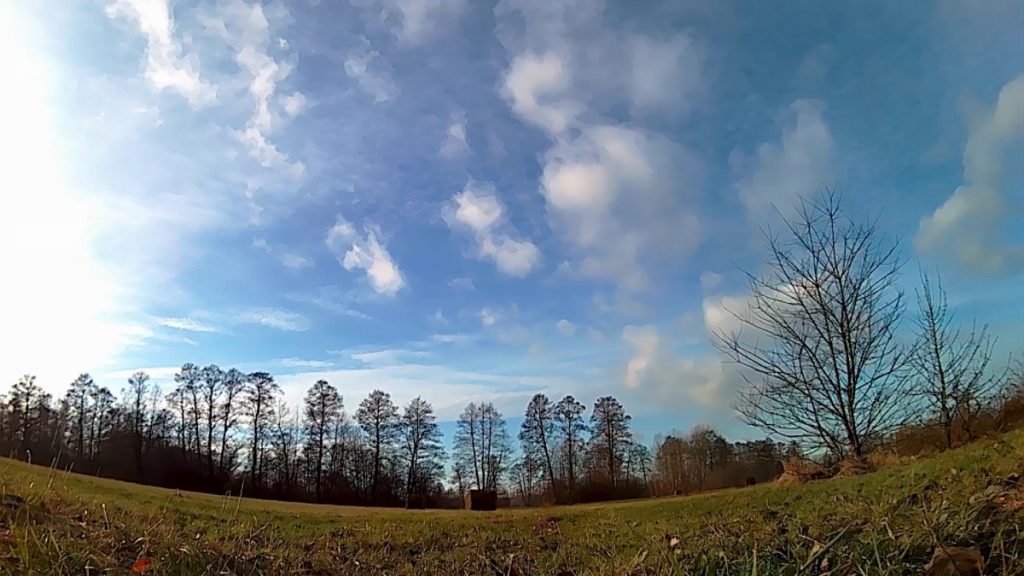
At what (x,y) coordinates should I click in order to perform the action: click on light. Please return your answer as a coordinate pair (x, y). The width and height of the screenshot is (1024, 576). Looking at the image, I should click on (22, 214).